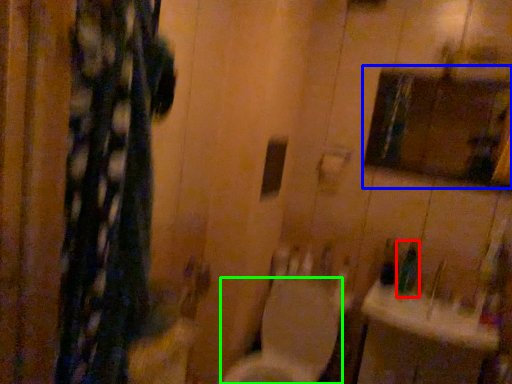
Question: Considering the real-world distances, which object is closest to toiletry (highlighted by a red box)? medicine cabinet (highlighted by a blue box) or toilet (highlighted by a green box).

Choices:
 (A) medicine cabinet
 (B) toilet

Answer: (B)